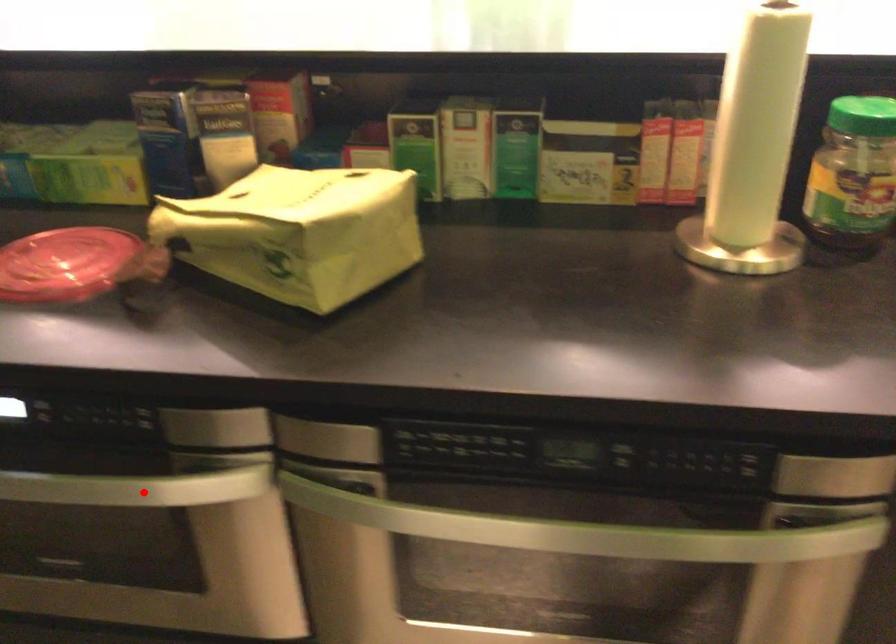
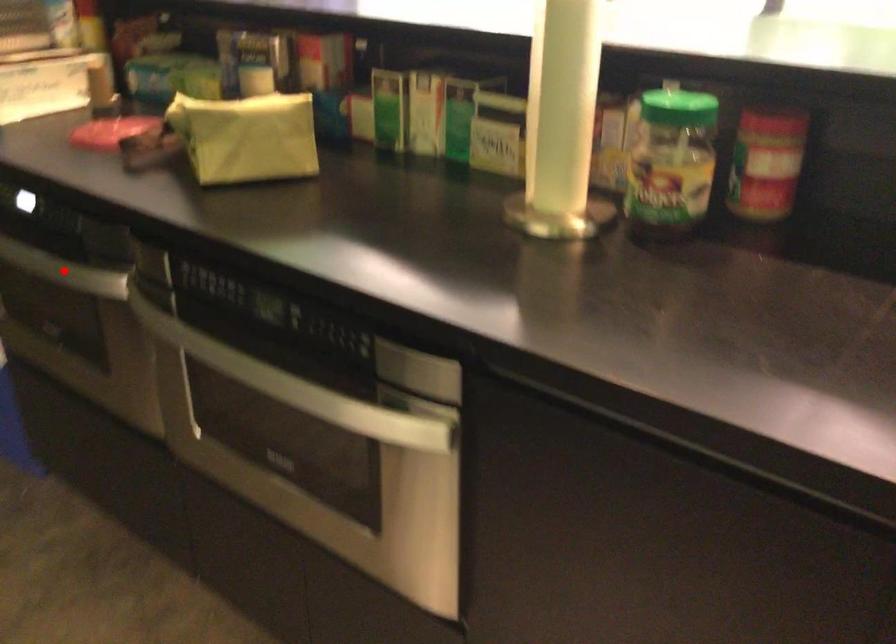
I am providing you with two images of the same scene from different viewpoints. A red point is marked on the first image and another point is marked on the second image. Does the point marked in image1 correspond to the same location as the one in image2?

Yes